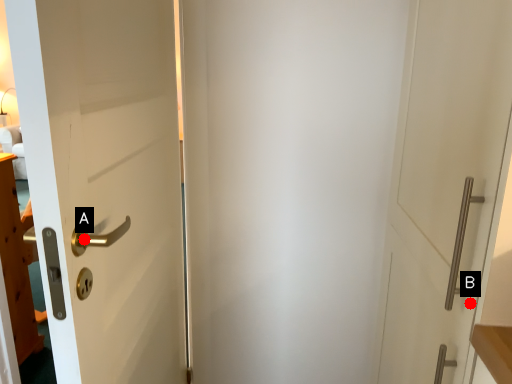
Question: Two points are circled on the image, labeled by A and B beside each circle. Which point is closer to the camera?

Choices:
 (A) A is closer
 (B) B is closer

Answer: (A)